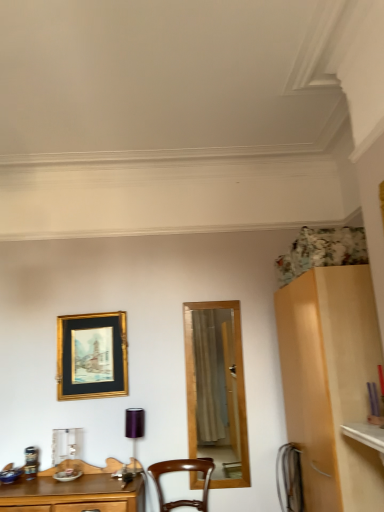
Question: Does brown wooden chair at center appear on the left side of gold/glossy picture frame at upper left?

Choices:
 (A) no
 (B) yes

Answer: (A)

Question: Is brown wooden chair at center to the right of gold/glossy picture frame at upper left from the viewer's perspective?

Choices:
 (A) yes
 (B) no

Answer: (A)

Question: Is brown wooden chair at center facing away from gold/glossy picture frame at upper left?

Choices:
 (A) no
 (B) yes

Answer: (A)

Question: From the image's perspective, is brown wooden chair at center located beneath gold/glossy picture frame at upper left?

Choices:
 (A) yes
 (B) no

Answer: (A)

Question: Is brown wooden chair at center next to gold/glossy picture frame at upper left and touching it?

Choices:
 (A) no
 (B) yes

Answer: (A)

Question: Is point (59, 368) positioned closer to the camera than point (135, 445)?

Choices:
 (A) farther
 (B) closer

Answer: (A)

Question: Based on their positions, is gold/glossy picture frame at upper left located to the left or right of purple metallic lamp at center?

Choices:
 (A) left
 (B) right

Answer: (A)

Question: Looking at the image, does gold/glossy picture frame at upper left seem bigger or smaller compared to purple metallic lamp at center?

Choices:
 (A) small
 (B) big

Answer: (B)

Question: Is gold/glossy picture frame at upper left wider or thinner than purple metallic lamp at center?

Choices:
 (A) thin
 (B) wide

Answer: (A)

Question: Is brown wooden chair at center in front of or behind gold/glossy picture frame at upper left in the image?

Choices:
 (A) behind
 (B) front

Answer: (B)

Question: Looking at their shapes, would you say brown wooden chair at center is wider or thinner than gold/glossy picture frame at upper left?

Choices:
 (A) wide
 (B) thin

Answer: (A)

Question: Considering the relative positions of brown wooden chair at center and gold/glossy picture frame at upper left in the image provided, is brown wooden chair at center to the left or to the right of gold/glossy picture frame at upper left?

Choices:
 (A) left
 (B) right

Answer: (B)

Question: In terms of height, does brown wooden chair at center look taller or shorter compared to gold/glossy picture frame at upper left?

Choices:
 (A) tall
 (B) short

Answer: (B)

Question: Does point (139, 411) appear closer or farther from the camera than point (155, 478)?

Choices:
 (A) farther
 (B) closer

Answer: (A)

Question: Is purple metallic lamp at center in front of or behind brown wooden chair at center in the image?

Choices:
 (A) front
 (B) behind

Answer: (B)